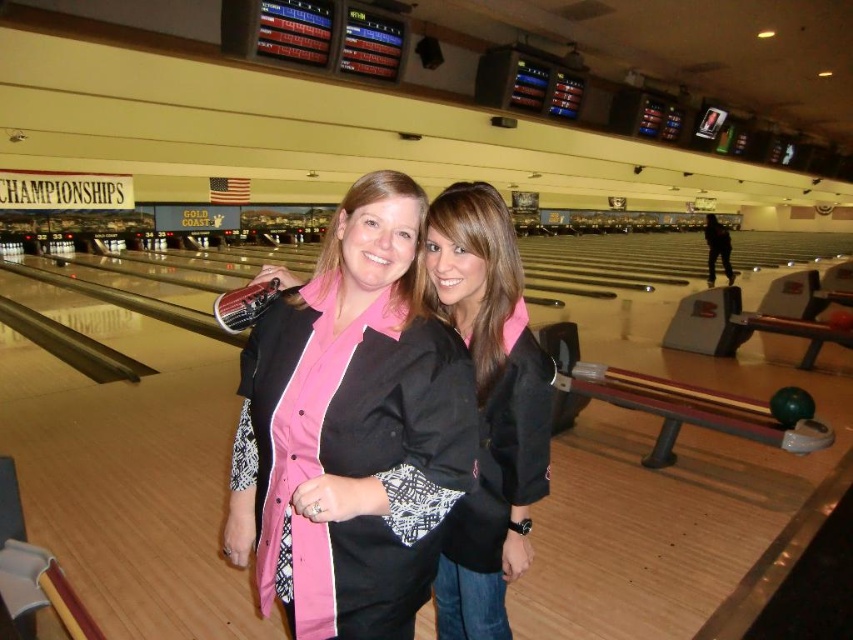
Can you confirm if pink fabric shirt at center is thinner than black matte jacket at center?

No.

Which is above, pink fabric shirt at center or black matte jacket at center?

pink fabric shirt at center is above.

Between point (260, 353) and point (509, 504), which one is positioned behind?

The point (509, 504) is more distant.

This screenshot has width=853, height=640. I want to click on pink fabric shirt at center, so click(352, 428).